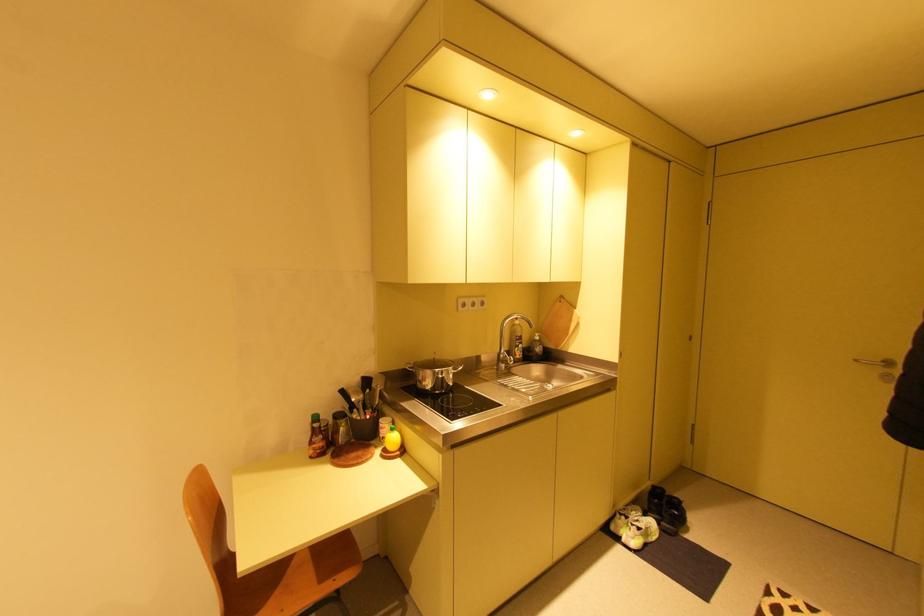
The location [392,440] corresponds to which object?

It refers to a yellow lemon bottle.